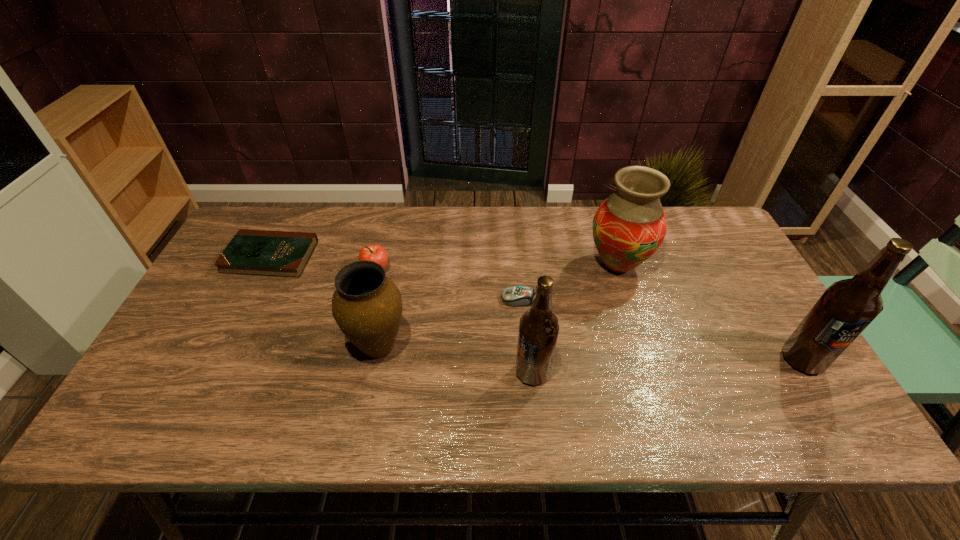
This screenshot has width=960, height=540. Identify the location of vacant position in the image that satisfies the following two spatial constraints: 1. on the label of the rightmost object; 2. on the label of the left beer bottle. (810, 373).